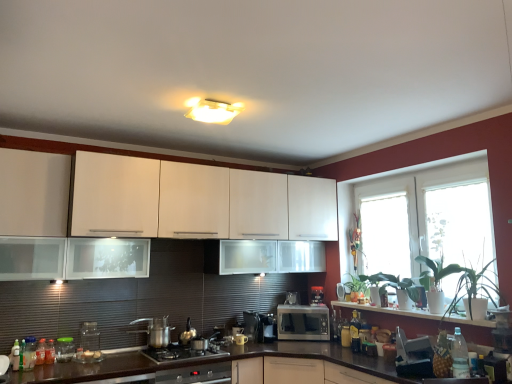
Image resolution: width=512 pixels, height=384 pixels. What do you see at coordinates (413, 356) in the screenshot? I see `metallic silver toaster at lower right, arranged as the 1th appliance when viewed from the front` at bounding box center [413, 356].

How much space does translucent plastic bottle at lower right, which appears as the 1th bottle when viewed from the back, occupy horizontally?

3.23 inches.

Locate an element on the screen. This screenshot has height=384, width=512. transparent glass window at center, the second window screen positioned from the front is located at coordinates (386, 234).

Image resolution: width=512 pixels, height=384 pixels. In order to click on metallic silver toaster at lower right, arranged as the 1th appliance when viewed from the front in this screenshot , I will do `click(413, 356)`.

Based on the photo, who is smaller, satin black coffee maker at center, the 5th appliance in the front-to-back sequence, or translucent plastic bottle at lower right, marked as the 2th bottle in a right-to-left arrangement?

translucent plastic bottle at lower right, marked as the 2th bottle in a right-to-left arrangement.

Is satin black coffee maker at center, the 5th appliance in the front-to-back sequence, placed right next to translucent plastic bottle at lower right, positioned as the second bottle in left-to-right order?

No, satin black coffee maker at center, the 5th appliance in the front-to-back sequence, is not with translucent plastic bottle at lower right, positioned as the second bottle in left-to-right order.

Which object is closer to the camera, satin black coffee maker at center, the 5th appliance in the front-to-back sequence, or translucent plastic bottle at lower right, marked as the 3th bottle in a front-to-back arrangement?

satin black coffee maker at center, the 5th appliance in the front-to-back sequence, is in front.

Is transparent glass window at center, which ranks as the first window screen in back-to-front order, directly adjacent to black plastic coffee machine at center?

No, transparent glass window at center, which ranks as the first window screen in back-to-front order, is not with black plastic coffee machine at center.

Is transparent glass window at center, which ranks as the 2th window screen in right-to-left order, not inside black plastic coffee machine at center?

Yes.

Is transparent glass window at right, the first window screen from the front, thinner than translucent plastic bottle at lower left, the third bottle positioned from the back?

Indeed, transparent glass window at right, the first window screen from the front, has a lesser width compared to translucent plastic bottle at lower left, the third bottle positioned from the back.

Is transparent glass window at right, the first window screen from the front, completely or partially outside of translucent plastic bottle at lower left, the third bottle positioned from the back?

Yes, transparent glass window at right, the first window screen from the front, is outside of translucent plastic bottle at lower left, the third bottle positioned from the back.

Can you confirm if transparent glass window at right, which appears as the second window screen when viewed from the left, is positioned to the left of translucent plastic bottle at lower left, the third bottle positioned from the back?

No, transparent glass window at right, which appears as the second window screen when viewed from the left, is not to the left of translucent plastic bottle at lower left, the third bottle positioned from the back.

Does point (436, 231) lie behind point (42, 338)?

Yes, it is behind point (42, 338).

Does point (460, 280) appear closer or farther from the camera than point (336, 334)?

Point (460, 280).

Between green glossy plant at right, the 1th plant in the front-to-back sequence, and translucent plastic bottle at lower right, marked as the 3th bottle in a front-to-back arrangement, which one has more height?

green glossy plant at right, the 1th plant in the front-to-back sequence.

Between green glossy plant at right, which is the 3th plant from back to front, and translucent plastic bottle at lower right, which appears as the 1th bottle when viewed from the back, which one has larger width?

Wider between the two is green glossy plant at right, which is the 3th plant from back to front.

Consider the image. Is green glossy plant at right, the 1th plant in the front-to-back sequence, located outside translucent plastic bottle at lower right, which appears as the 1th bottle when viewed from the back?

green glossy plant at right, the 1th plant in the front-to-back sequence, lies outside translucent plastic bottle at lower right, which appears as the 1th bottle when viewed from the back,'s area.

Is clear glass jar at lower left, which is the third appliance in front-to-back order, far away from transparent glass jar at lower left, which is the 2th appliance in front-to-back order?

That's not correct — clear glass jar at lower left, which is the third appliance in front-to-back order, is a little close to transparent glass jar at lower left, which is the 2th appliance in front-to-back order.

Would you say clear glass jar at lower left, which is counted as the second appliance, starting from the left, is inside or outside transparent glass jar at lower left, which is the 2th appliance in front-to-back order?

clear glass jar at lower left, which is counted as the second appliance, starting from the left, lies outside transparent glass jar at lower left, which is the 2th appliance in front-to-back order.

From the picture: Can you confirm if clear glass jar at lower left, the 4th appliance positioned from the back, is taller than transparent glass jar at lower left, marked as the 1th appliance in a left-to-right arrangement?

Yes, clear glass jar at lower left, the 4th appliance positioned from the back, is taller than transparent glass jar at lower left, marked as the 1th appliance in a left-to-right arrangement.

In the scene shown: Is clear glass jar at lower left, the 4th appliance positioned from the back, oriented towards transparent glass jar at lower left, the sixth appliance positioned from the right?

No, clear glass jar at lower left, the 4th appliance positioned from the back, does not turn towards transparent glass jar at lower left, the sixth appliance positioned from the right.

Who is bigger, dark brown laminate countertop at lower center or satin silver microwave at center?

With larger size is dark brown laminate countertop at lower center.

From a real-world perspective, is dark brown laminate countertop at lower center physically located above or below satin silver microwave at center?

In terms of real-world spatial position, dark brown laminate countertop at lower center is below satin silver microwave at center.

Who is more distant, dark brown laminate countertop at lower center or satin silver microwave at center?

satin silver microwave at center is further away from the camera.

Can you confirm if dark brown laminate countertop at lower center is shorter than satin silver microwave at center?

In fact, dark brown laminate countertop at lower center may be taller than satin silver microwave at center.

From the image's perspective, which is below, satin black coffee maker at center, which is the third appliance in right-to-left order, or stainless steel pot at lower center?

From the image's view, satin black coffee maker at center, which is the third appliance in right-to-left order, is below.

Is point (259, 317) farther from viewer compared to point (134, 321)?

Yes, point (259, 317) is farther from viewer.

Between satin black coffee maker at center, the 5th appliance in the front-to-back sequence, and stainless steel pot at lower center, which one appears on the right side from the viewer's perspective?

Positioned to the right is satin black coffee maker at center, the 5th appliance in the front-to-back sequence.

Could you tell me if satin black coffee maker at center, which is the third appliance in right-to-left order, is facing stainless steel pot at lower center?

No.

Locate an element on the screen. Image resolution: width=512 pixels, height=384 pixels. bottle that is the 1st one when counting upward from the satin black coffee maker at center, which is the third appliance in right-to-left order (from the image's perspective) is located at coordinates (334, 326).

I want to click on the 1st window screen in front of the black plastic coffee machine at center, so click(386, 234).

Looking at the image, which one is located further to matte glass mug at center, which is the 6th appliance from front to back, green glossy plant at right, the 2th plant when ordered from front to back, or satin silver microwave at center?

Based on the image, green glossy plant at right, the 2th plant when ordered from front to back, appears to be further to matte glass mug at center, which is the 6th appliance from front to back.

Looking at the image, which one is located further to black plastic coffee machine at center, transparent glass window at center, which ranks as the 2th window screen in right-to-left order, or golden glass bottle at center-right, which is the 1th bottle from right to left?

transparent glass window at center, which ranks as the 2th window screen in right-to-left order.

Estimate the real-world distances between objects in this image. Which object is closer to transparent glass window at right, which is the second window screen in back-to-front order, metallic silver kettle at center, which is the 3th appliance in left-to-right order, or green glossy plant at right, which is the 3th plant from back to front?

Based on the image, green glossy plant at right, which is the 3th plant from back to front, appears to be nearer to transparent glass window at right, which is the second window screen in back-to-front order.

Based on their spatial positions, is golden glass bottle at center-right, which is the 3th bottle in left-to-right order, or satin silver microwave at center closer to satin black coffee maker at center, the fourth appliance from the left?

satin silver microwave at center is positioned closer to the anchor satin black coffee maker at center, the fourth appliance from the left.

Considering their positions, is golden glass bottle at center-right, the second bottle when ordered from front to back, positioned further to green glossy plant at right, which is the 3th plant from back to front, than black plastic coffee machine at center?

Based on the image, black plastic coffee machine at center appears to be further to green glossy plant at right, which is the 3th plant from back to front.

From the image, which object appears to be farther from golden glass bottle at center-right, the second bottle when ordered from front to back, matte glass mug at center, which is the 6th appliance from front to back, or satin silver microwave at center?

The object further to golden glass bottle at center-right, the second bottle when ordered from front to back, is matte glass mug at center, which is the 6th appliance from front to back.

Estimate the real-world distances between objects in this image. Which object is closer to black plastic coffee machine at center, clear glass jar at lower left, acting as the fifth appliance starting from the right, or green leafy plant at right, arranged as the third plant when viewed from the front?

Based on the image, green leafy plant at right, arranged as the third plant when viewed from the front, appears to be nearer to black plastic coffee machine at center.

Looking at the image, which one is located further to translucent plastic bottle at lower left, which appears as the first bottle when viewed from the front, translucent plastic bottle at lower right, positioned as the second bottle in left-to-right order, or black plastic coffee machine at center?

black plastic coffee machine at center is positioned further to the anchor translucent plastic bottle at lower left, which appears as the first bottle when viewed from the front.

At what (x,y) coordinates should I click in order to perform the action: click on microwave oven between stainless steel gas stove at center and green leafy plant at right, arranged as the third plant when viewed from the front, from left to right. Please return your answer as a coordinate pair (x, y). Image resolution: width=512 pixels, height=384 pixels. Looking at the image, I should click on (303, 322).

In order to click on coffee machine positioned between white glossy window at lower right and matte glass mug at center, which is the 6th appliance from front to back, from near to far in this screenshot , I will do `click(317, 295)`.

Find the location of a particular element. This screenshot has width=512, height=384. microwave oven situated between stainless steel gas stove at center and translucent plastic bottle at lower right, marked as the 2th bottle in a right-to-left arrangement, from left to right is located at coordinates (303, 322).

The height and width of the screenshot is (384, 512). What are the coordinates of `window screen located between metallic silver kettle at center, which is the 3th appliance in left-to-right order, and green glossy plant at right, the 2th plant when ordered from front to back, in the left-right direction` in the screenshot? It's located at (386, 234).